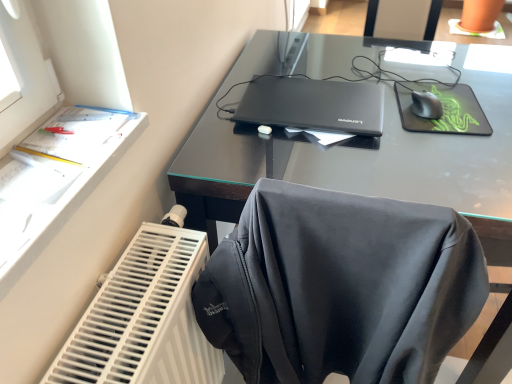
Question: Is black matte laptop at center inside green matte mousepad at upper right?

Choices:
 (A) no
 (B) yes

Answer: (A)

Question: Is green matte mousepad at upper right positioned in front of black matte laptop at center?

Choices:
 (A) no
 (B) yes

Answer: (A)

Question: Can you confirm if green matte mousepad at upper right is wider than black matte laptop at center?

Choices:
 (A) yes
 (B) no

Answer: (B)

Question: From the image's perspective, is green matte mousepad at upper right on top of black matte laptop at center?

Choices:
 (A) no
 (B) yes

Answer: (A)

Question: From the image's perspective, is green matte mousepad at upper right under black matte laptop at center?

Choices:
 (A) yes
 (B) no

Answer: (A)

Question: Is green matte mousepad at upper right oriented away from black matte laptop at center?

Choices:
 (A) yes
 (B) no

Answer: (B)

Question: From a real-world perspective, is white plastic radiator at lower left positioned under green matte mousepad at upper right based on gravity?

Choices:
 (A) no
 (B) yes

Answer: (B)

Question: Considering the relative positions of white plastic radiator at lower left and green matte mousepad at upper right in the image provided, is white plastic radiator at lower left to the left of green matte mousepad at upper right from the viewer's perspective?

Choices:
 (A) yes
 (B) no

Answer: (A)

Question: Can you confirm if white plastic radiator at lower left is bigger than green matte mousepad at upper right?

Choices:
 (A) yes
 (B) no

Answer: (A)

Question: Could green matte mousepad at upper right be considered to be inside white plastic radiator at lower left?

Choices:
 (A) no
 (B) yes

Answer: (A)

Question: Can you confirm if white plastic radiator at lower left is positioned to the right of green matte mousepad at upper right?

Choices:
 (A) yes
 (B) no

Answer: (B)

Question: Does white plastic radiator at lower left have a lesser width compared to green matte mousepad at upper right?

Choices:
 (A) yes
 (B) no

Answer: (A)

Question: Considering the relative sizes of black matte mouse at upper right and white plastic radiator at lower left in the image provided, is black matte mouse at upper right taller than white plastic radiator at lower left?

Choices:
 (A) no
 (B) yes

Answer: (A)